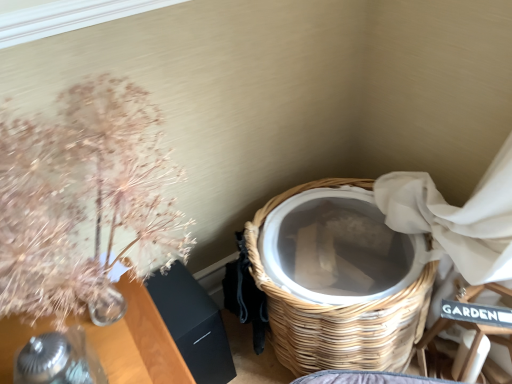
The width and height of the screenshot is (512, 384). Describe the element at coordinates (471, 345) in the screenshot. I see `wooden armchair at lower right` at that location.

Measure the distance between point (492, 330) and camera.

37.91 inches.

What is the approximate width of translucent glass vase with dried flowers at upper left?

The width of translucent glass vase with dried flowers at upper left is 16.68 inches.

Where is `wooden armchair at lower right`? wooden armchair at lower right is located at coordinates (471, 345).

Is point (345, 317) positioned behind point (95, 232)?

No.

Is woven wood basket at lower right behind translucent glass vase with dried flowers at upper left?

Yes.

The height and width of the screenshot is (384, 512). I want to click on floral arrangement above the woven wood basket at lower right (from the image's perspective), so click(x=83, y=199).

Who is bigger, woven wood basket at lower right or translucent glass vase with dried flowers at upper left?

With larger size is woven wood basket at lower right.

Is point (306, 350) closer to camera compared to point (421, 372)?

Yes, point (306, 350) is in front of point (421, 372).

Which object is more forward, woven wood basket at lower right or wooden armchair at lower right?

woven wood basket at lower right is in front.

Is wooden armchair at lower right at the back of woven wood basket at lower right?

No, wooden armchair at lower right is not at the back of woven wood basket at lower right.

Is woven wood basket at lower right in contact with wooden armchair at lower right?

woven wood basket at lower right and wooden armchair at lower right are not in contact.

How many degrees apart are the facing directions of translucent glass vase with dried flowers at upper left and wooden armchair at lower right?

The facing directions of translucent glass vase with dried flowers at upper left and wooden armchair at lower right are 39.6 degrees apart.

From a real-world perspective, is translucent glass vase with dried flowers at upper left positioned above or below wooden armchair at lower right?

Clearly, from a real-world perspective, translucent glass vase with dried flowers at upper left is above wooden armchair at lower right.

Do you think translucent glass vase with dried flowers at upper left is within wooden armchair at lower right, or outside of it?

translucent glass vase with dried flowers at upper left is located beyond the bounds of wooden armchair at lower right.

I want to click on armchair that is below the translucent glass vase with dried flowers at upper left (from the image's perspective), so click(471, 345).

Which of these two, translucent glass vase with dried flowers at upper left or woven wood basket at lower right, is bigger?

woven wood basket at lower right is bigger.

Is woven wood basket at lower right located within translucent glass vase with dried flowers at upper left?

Actually, woven wood basket at lower right is outside translucent glass vase with dried flowers at upper left.

Which of these two, translucent glass vase with dried flowers at upper left or woven wood basket at lower right, stands taller?

With more height is woven wood basket at lower right.

Are translucent glass vase with dried flowers at upper left and woven wood basket at lower right making contact?

No, translucent glass vase with dried flowers at upper left is not making contact with woven wood basket at lower right.

Who is taller, wooden armchair at lower right or translucent glass vase with dried flowers at upper left?

With more height is wooden armchair at lower right.

Is wooden armchair at lower right wider than translucent glass vase with dried flowers at upper left?

In fact, wooden armchair at lower right might be narrower than translucent glass vase with dried flowers at upper left.

Between wooden armchair at lower right and translucent glass vase with dried flowers at upper left, which one appears on the left side from the viewer's perspective?

Positioned to the left is translucent glass vase with dried flowers at upper left.

Looking at this image, is wooden armchair at lower right in front of or behind woven wood basket at lower right in the image?

wooden armchair at lower right is behind woven wood basket at lower right.

Is wooden armchair at lower right bigger or smaller than woven wood basket at lower right?

In the image, wooden armchair at lower right appears to be smaller than woven wood basket at lower right.

From the image's perspective, which one is positioned lower, wooden armchair at lower right or woven wood basket at lower right?

From the image's view, wooden armchair at lower right is below.

Image resolution: width=512 pixels, height=384 pixels. I want to click on basket on the right of translucent glass vase with dried flowers at upper left, so click(339, 313).

Image resolution: width=512 pixels, height=384 pixels. What are the coordinates of `basket that is above the wooden armchair at lower right (from the image's perspective)` in the screenshot? It's located at pos(339,313).

Based on their spatial positions, is woven wood basket at lower right or translucent glass vase with dried flowers at upper left closer to wooden armchair at lower right?

Based on the image, woven wood basket at lower right appears to be nearer to wooden armchair at lower right.

Estimate the real-world distances between objects in this image. Which object is further from translucent glass vase with dried flowers at upper left, woven wood basket at lower right or wooden armchair at lower right?

wooden armchair at lower right is positioned further to the anchor translucent glass vase with dried flowers at upper left.

From the image, which object appears to be nearer to wooden armchair at lower right, translucent glass vase with dried flowers at upper left or woven wood basket at lower right?

woven wood basket at lower right lies closer to wooden armchair at lower right than the other object.

Based on their spatial positions, is wooden armchair at lower right or woven wood basket at lower right further from translucent glass vase with dried flowers at upper left?

wooden armchair at lower right is further to translucent glass vase with dried flowers at upper left.

Based on their spatial positions, is wooden armchair at lower right or translucent glass vase with dried flowers at upper left further from woven wood basket at lower right?

translucent glass vase with dried flowers at upper left is positioned further to the anchor woven wood basket at lower right.

Based on their spatial positions, is translucent glass vase with dried flowers at upper left or wooden armchair at lower right closer to woven wood basket at lower right?

Based on the image, wooden armchair at lower right appears to be nearer to woven wood basket at lower right.

Identify the location of basket between translucent glass vase with dried flowers at upper left and wooden armchair at lower right. (339, 313).